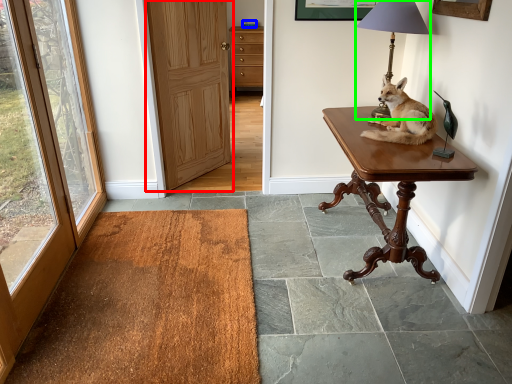
Question: Which object is the farthest from door (highlighted by a red box)? Choose among these: corded phone (highlighted by a blue box) or lamp (highlighted by a green box).

Choices:
 (A) corded phone
 (B) lamp

Answer: (A)